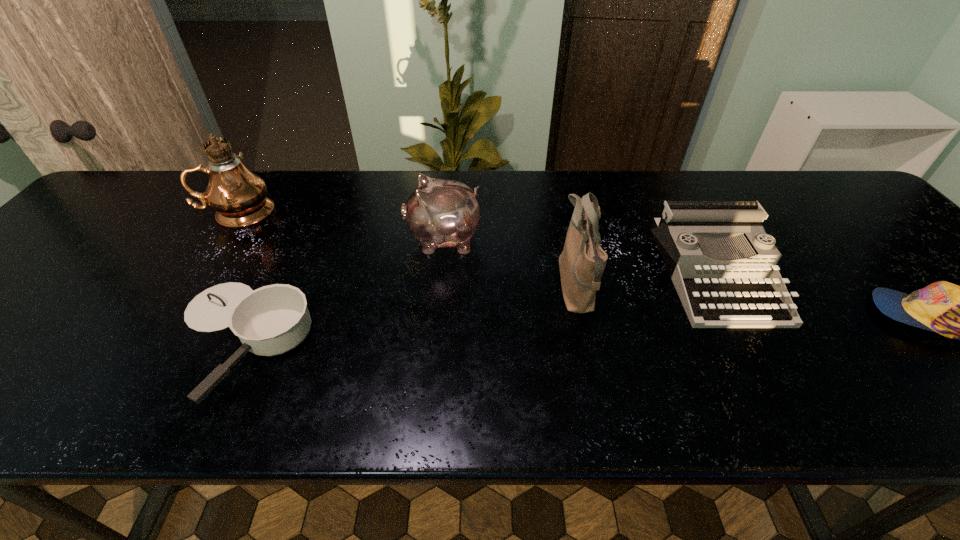
Locate an element on the screen. the tallest object is located at coordinates (x=239, y=196).

The height and width of the screenshot is (540, 960). Find the location of `shoulder bag`. shoulder bag is located at coordinates (582, 262).

This screenshot has height=540, width=960. Identify the location of the fourth object from left to right. (582, 262).

Locate an element on the screen. Image resolution: width=960 pixels, height=540 pixels. piggy bank is located at coordinates (440, 213).

At what (x,y) coordinates should I click in order to perform the action: click on the third object from left to right. Please return your answer as a coordinate pair (x, y). This screenshot has height=540, width=960. Looking at the image, I should click on (440, 213).

I want to click on the fourth tallest object, so click(716, 293).

The height and width of the screenshot is (540, 960). I want to click on typewriter, so click(716, 293).

At what (x,y) coordinates should I click in order to perform the action: click on the shortest object. Please return your answer as a coordinate pair (x, y). Looking at the image, I should click on (271, 320).

Locate an element on the screen. The width and height of the screenshot is (960, 540). free space located 0.050m on the back of the oil lamp is located at coordinates click(255, 187).

The width and height of the screenshot is (960, 540). I want to click on free space located on the front-facing side of the fifth shortest object, so click(495, 287).